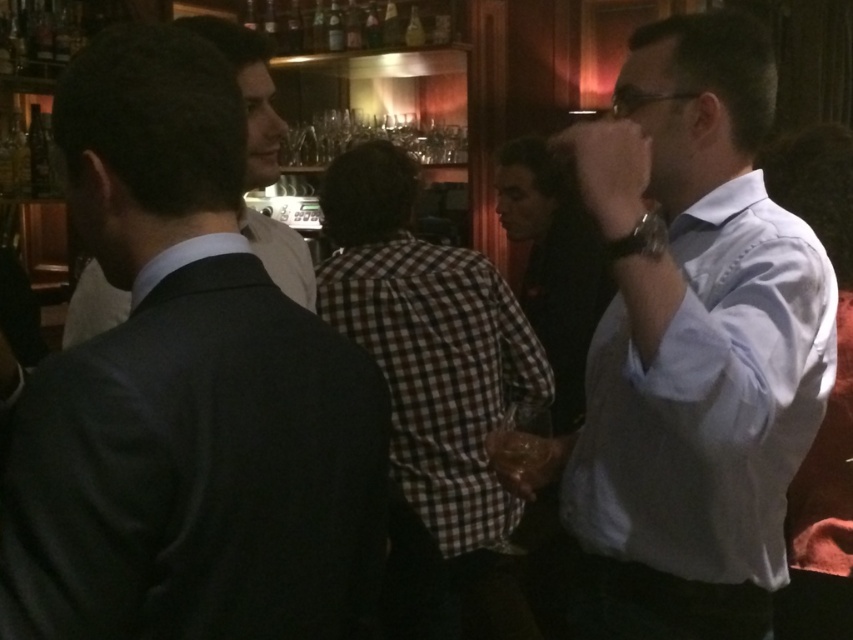
Question: Which object is farther from the camera taking this photo?

Choices:
 (A) dark gray suit at left
 (B) checkered fabric shirt at center
 (C) light blue shirt at right

Answer: (B)

Question: Which point is closer to the camera?

Choices:
 (A) dark gray suit at left
 (B) dark suit jacket at center
 (C) glass bottles at upper center

Answer: (A)

Question: Does dark gray suit at left appear on the left side of glass bottles at upper center?

Choices:
 (A) no
 (B) yes

Answer: (A)

Question: Can you confirm if light blue shirt at right is positioned below dark suit jacket at center?

Choices:
 (A) yes
 (B) no

Answer: (A)

Question: Does checkered shirt at center appear under glass bottles at upper center?

Choices:
 (A) no
 (B) yes

Answer: (B)

Question: Which point is closer to the camera?

Choices:
 (A) dark suit jacket at center
 (B) light blue shirt at right

Answer: (A)